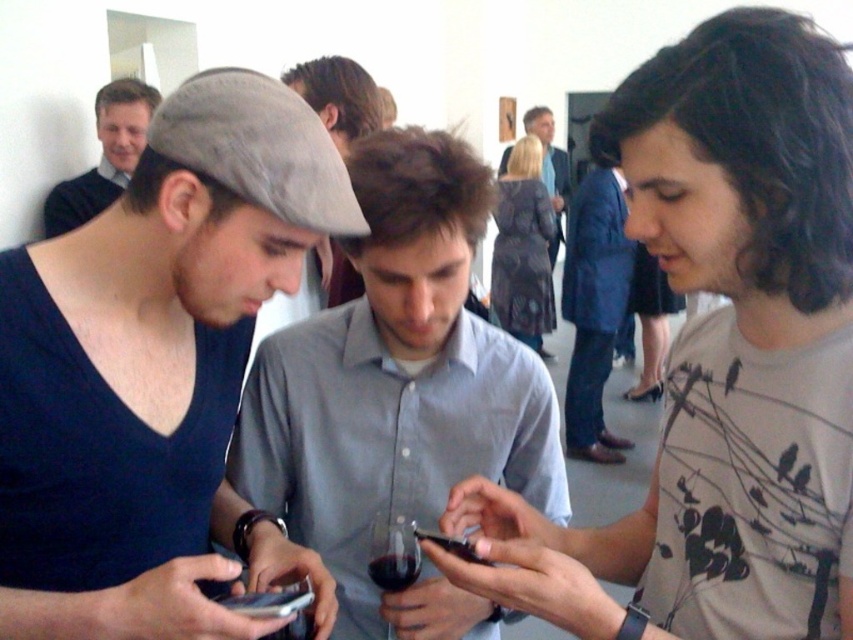
You are a photographer trying to capture a clear shot of the black glossy smartphone at center. However, the matte gray cap at center is blocking your view. Based on the scene description, can you determine if you can see the smartphone without moving the cap?

The matte gray cap at center is in front of the black glossy smartphone at center, so the cap is blocking the view of the smartphone. Therefore, you cannot see the smartphone clearly without moving the cap.

You are a photographer trying to capture a candid shot of the matte gray cap at center and the black glossy smartphone at center. If the smartphone is held at the same height as the cap, will the smartphone fit entirely within the frame if the cap is centered?

The matte gray cap at center might be wider than black glossy smartphone at center, so there is a possibility that the smartphone will fit within the frame if the cap is centered, but it depends on the exact width difference between them.

You are standing in the room and want to touch the matte gray cap at center. The point you need to reach is at coordinate point [152,362]. Is this point located on the matte gray cap at center?

Yes, the point [152,362] is on the matte gray cap at center.